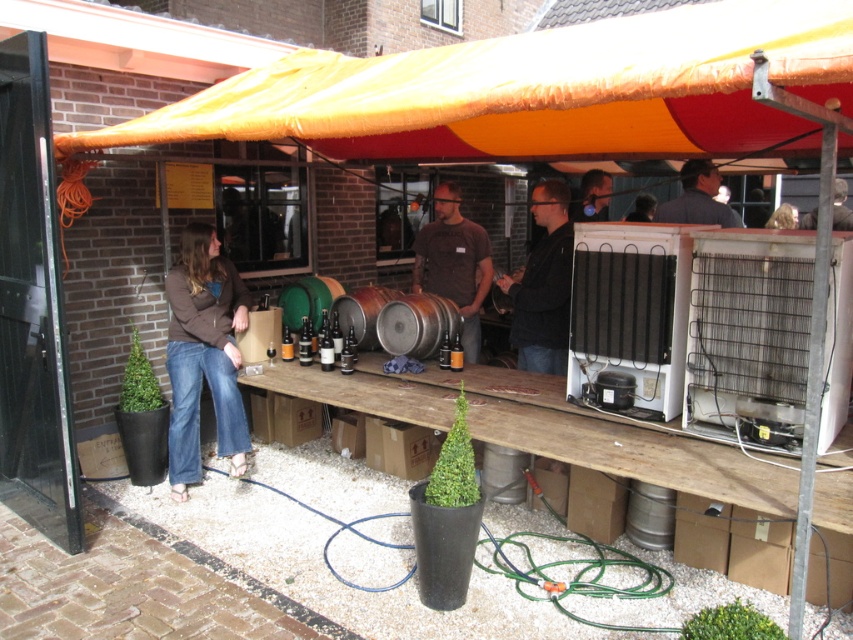
Is brown fabric shirt at center to the right of dark blue shirt at upper right from the viewer's perspective?

Incorrect, brown fabric shirt at center is not on the right side of dark blue shirt at upper right.

Does point (463, 310) come closer to viewer compared to point (666, 220)?

No, (463, 310) is further to viewer.

This screenshot has height=640, width=853. I want to click on brown fabric shirt at center, so 454,262.

I want to click on brown fabric shirt at center, so click(x=454, y=262).

What do you see at coordinates (543, 285) in the screenshot? I see `black matte jacket at center` at bounding box center [543, 285].

Is point (556, 275) in front of point (740, 218)?

Yes, it is.

Does point (544, 344) come farther from viewer compared to point (718, 214)?

No, it is in front of (718, 214).

The image size is (853, 640). Find the location of `black matte jacket at center`. black matte jacket at center is located at coordinates (543, 285).

Is brown denim jeans at lower left further to camera compared to matte black jacket at center?

No, it is in front of matte black jacket at center.

Does brown denim jeans at lower left have a lesser width compared to matte black jacket at center?

In fact, brown denim jeans at lower left might be wider than matte black jacket at center.

Find the location of a particular element. brown denim jeans at lower left is located at coordinates (202, 355).